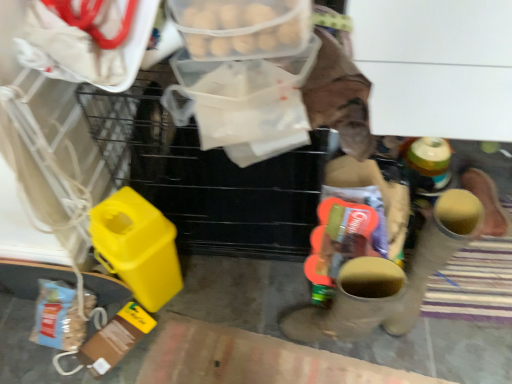
Question: Is translucent plastic container at upper center thinner than rubber yellow boot at right, which is the 1th footwear in right-to-left order?

Choices:
 (A) no
 (B) yes

Answer: (B)

Question: Is translucent plastic container at upper center not near rubber yellow boot at right, which is the 1th footwear in right-to-left order?

Choices:
 (A) yes
 (B) no

Answer: (B)

Question: Can you confirm if translucent plastic container at upper center is shorter than rubber yellow boot at right, which is the 1th footwear in right-to-left order?

Choices:
 (A) no
 (B) yes

Answer: (B)

Question: Does translucent plastic container at upper center turn towards rubber yellow boot at right, which is the 1th footwear in right-to-left order?

Choices:
 (A) no
 (B) yes

Answer: (A)

Question: Can you confirm if translucent plastic container at upper center is bigger than rubber yellow boot at right, which is the 1th footwear in right-to-left order?

Choices:
 (A) yes
 (B) no

Answer: (B)

Question: Can you confirm if translucent plastic container at upper center is positioned to the right of rubber yellow boot at right, which is the 1th footwear in right-to-left order?

Choices:
 (A) yes
 (B) no

Answer: (B)

Question: Can you confirm if matte brown boot at center, positioned as the first footwear in left-to-right order, is positioned to the left of rubber yellow boot at right, the second footwear in the left-to-right sequence?

Choices:
 (A) no
 (B) yes

Answer: (B)

Question: Considering the relative sizes of matte brown boot at center, positioned as the first footwear in left-to-right order, and rubber yellow boot at right, the second footwear in the left-to-right sequence, in the image provided, is matte brown boot at center, positioned as the first footwear in left-to-right order, smaller than rubber yellow boot at right, the second footwear in the left-to-right sequence,?

Choices:
 (A) yes
 (B) no

Answer: (A)

Question: From the image's perspective, does matte brown boot at center, which appears as the second footwear when viewed from the right, appear higher than rubber yellow boot at right, the second footwear in the left-to-right sequence?

Choices:
 (A) no
 (B) yes

Answer: (A)

Question: From the image's perspective, does matte brown boot at center, which appears as the second footwear when viewed from the right, appear lower than rubber yellow boot at right, the second footwear in the left-to-right sequence?

Choices:
 (A) yes
 (B) no

Answer: (A)

Question: Does matte brown boot at center, positioned as the first footwear in left-to-right order, have a greater width compared to rubber yellow boot at right, the second footwear in the left-to-right sequence?

Choices:
 (A) no
 (B) yes

Answer: (B)

Question: Is matte brown boot at center, which appears as the second footwear when viewed from the right, closer to the viewer compared to rubber yellow boot at right, the second footwear in the left-to-right sequence?

Choices:
 (A) no
 (B) yes

Answer: (B)

Question: Is matte brown boot at center, which appears as the second footwear when viewed from the right, surrounded by translucent plastic container at upper center?

Choices:
 (A) yes
 (B) no

Answer: (B)